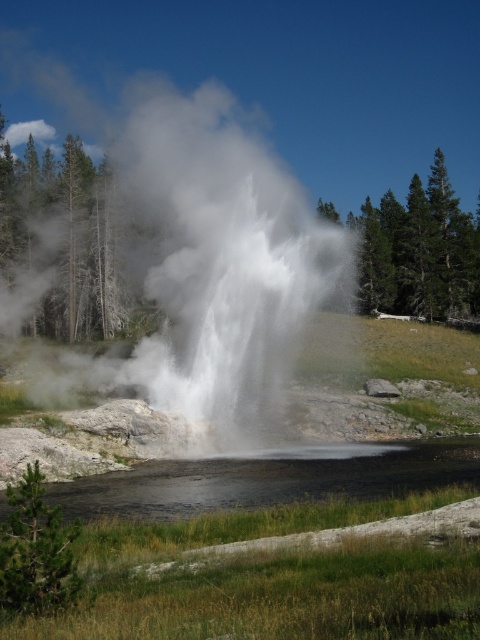
Based on the photo, can you confirm if white vapor at center is positioned above black reflective water at lower center?

Correct, white vapor at center is located above black reflective water at lower center.

Where is `white vapor at center`? Image resolution: width=480 pixels, height=640 pixels. white vapor at center is located at coordinates (217, 266).